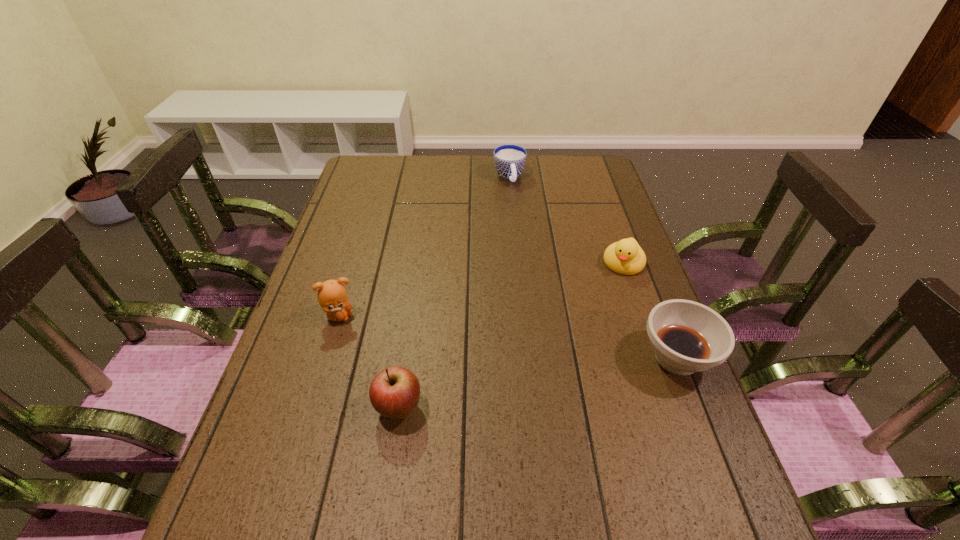
This screenshot has width=960, height=540. I want to click on vacant space that is in between the soup bowl and the second farthest object, so click(x=650, y=310).

This screenshot has height=540, width=960. I want to click on free spot between the teddy bear and the second farthest object, so click(482, 289).

Locate an element on the screen. This screenshot has height=540, width=960. vacant area that lies between the soup bowl and the apple is located at coordinates (538, 383).

Identify the location of unoccupied position between the soup bowl and the fourth object from right to left. (538, 383).

This screenshot has height=540, width=960. I want to click on free space between the apple and the leftmost object, so click(x=370, y=362).

At what (x,y) coordinates should I click in order to perform the action: click on vacant area that lies between the farthest object and the duckling. Please return your answer as a coordinate pair (x, y). Looking at the image, I should click on (566, 220).

Identify the location of free spot between the duckling and the soup bowl. (650, 310).

I want to click on object that can be found as the closest to the soup bowl, so click(x=626, y=257).

Identify the location of object that stands as the fourth closest to the leftmost object. The width and height of the screenshot is (960, 540). (686, 337).

Identify the location of free spot that satisfies the following two spatial constraints: 1. on the front side of the third object from left to right; 2. on the right side of the duckling. The height and width of the screenshot is (540, 960). (516, 263).